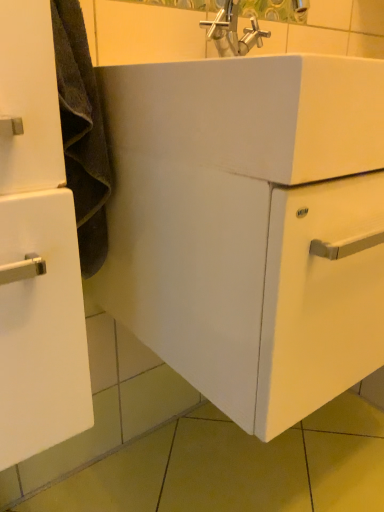
The height and width of the screenshot is (512, 384). Describe the element at coordinates (251, 113) in the screenshot. I see `white glossy sink at center` at that location.

Find the location of a particular element. The height and width of the screenshot is (512, 384). white glossy sink at center is located at coordinates (251, 113).

Measure the distance between white matte cabinet at left and camera.

white matte cabinet at left is 14.67 inches from camera.

At what (x,y) coordinates should I click in order to perform the action: click on white matte cabinet at left. Please return your answer as a coordinate pair (x, y). Image resolution: width=384 pixels, height=512 pixels. Looking at the image, I should click on (37, 249).

The image size is (384, 512). Describe the element at coordinates (37, 249) in the screenshot. I see `white matte cabinet at left` at that location.

Where is `white glossy sink at center`? Image resolution: width=384 pixels, height=512 pixels. white glossy sink at center is located at coordinates (251, 113).

Considering the relative positions of white glossy sink at center and white matte cabinet at left in the image provided, is white glossy sink at center to the left of white matte cabinet at left from the viewer's perspective?

Incorrect, white glossy sink at center is not on the left side of white matte cabinet at left.

Does white glossy sink at center lie in front of white matte cabinet at left?

That is True.

Which is in front, point (333, 83) or point (2, 390)?

Point (333, 83)

From the picture: From the image's perspective, which one is positioned lower, white glossy sink at center or white matte cabinet at left?

white matte cabinet at left.

From a real-world perspective, is white glossy sink at center positioned under white matte cabinet at left based on gravity?

No.

Is white glossy sink at center thinner than white matte cabinet at left?

No.

Who is taller, white glossy sink at center or white matte cabinet at left?

With more height is white matte cabinet at left.

In terms of size, does white glossy sink at center appear bigger or smaller than white matte cabinet at left?

Considering their sizes, white glossy sink at center takes up more space than white matte cabinet at left.

Is white glossy sink at center inside the boundaries of white matte cabinet at left, or outside?

white glossy sink at center is not enclosed by white matte cabinet at left.

Are white glossy sink at center and white matte cabinet at left far apart?

white glossy sink at center is near white matte cabinet at left, not far away.

Is white glossy sink at center oriented towards white matte cabinet at left?

No, white glossy sink at center is not turned towards white matte cabinet at left.

You are a GUI agent. You are given a task and a screenshot of the screen. Output one action in this format:
    pyautogui.click(x=<x>, y=<y>)
    Task: Click on the bathroom cabinet lying on the left of white glossy sink at center
    Image resolution: width=384 pixels, height=512 pixels.
    Given the screenshot: What is the action you would take?
    pyautogui.click(x=37, y=249)

Considering the relative positions of white matte cabinet at left and white glossy sink at center in the image provided, is white matte cabinet at left to the right of white glossy sink at center from the viewer's perspective?

Incorrect, white matte cabinet at left is not on the right side of white glossy sink at center.

Does white matte cabinet at left come in front of white glossy sink at center?

No, it is behind white glossy sink at center.

Does point (75, 378) lie in front of point (126, 144)?

Yes, it is.

From the image's perspective, is white matte cabinet at left above or below white glossy sink at center?

white matte cabinet at left is below white glossy sink at center.

From a real-world perspective, is white matte cabinet at left physically below white glossy sink at center?

Yes, from a real-world perspective, white matte cabinet at left is under white glossy sink at center.

Can you confirm if white matte cabinet at left is thinner than white glossy sink at center?

Yes, white matte cabinet at left is thinner than white glossy sink at center.

In the scene shown: Can you confirm if white matte cabinet at left is shorter than white glossy sink at center?

No, white matte cabinet at left is not shorter than white glossy sink at center.

Does white matte cabinet at left have a larger size compared to white glossy sink at center?

No.

Choose the correct answer: Is white matte cabinet at left inside white glossy sink at center or outside it?

white matte cabinet at left is not enclosed by white glossy sink at center.

Are white matte cabinet at left and white glossy sink at center beside each other?

No, white matte cabinet at left is not with white glossy sink at center.

Based on the photo, is white matte cabinet at left positioned with its back to white glossy sink at center?

No, white glossy sink at center is not at the back of white matte cabinet at left.

What's the angular difference between white matte cabinet at left and white glossy sink at center's facing directions?

They differ by 2.14e-05 degrees in their facing directions.

You are a GUI agent. You are given a task and a screenshot of the screen. Output one action in this format:
    pyautogui.click(x=<x>, y=<y>)
    Task: Click on the sink that is in front of the white matte cabinet at left
    
    Given the screenshot: What is the action you would take?
    pyautogui.click(x=251, y=113)

Locate an element on the screen. The width and height of the screenshot is (384, 512). bathroom cabinet located on the left of white glossy sink at center is located at coordinates (37, 249).

Locate an element on the screen. bathroom cabinet lying below the white glossy sink at center (from the image's perspective) is located at coordinates (37, 249).